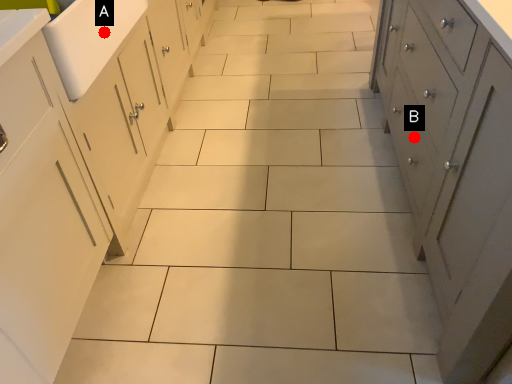
Question: Two points are circled on the image, labeled by A and B beside each circle. Which point appears closest to the camera in this image?

Choices:
 (A) A is closer
 (B) B is closer

Answer: (A)